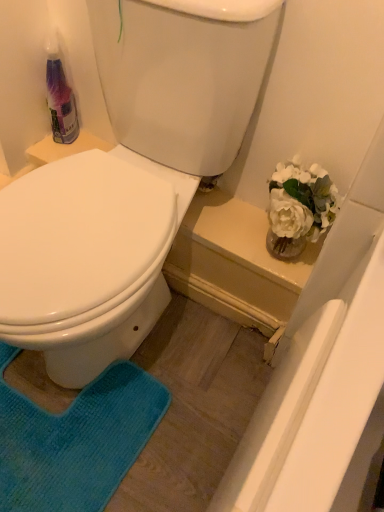
Question: Considering the relative sizes of white glossy toilet at center and translucent plastic bottle at upper left in the image provided, is white glossy toilet at center shorter than translucent plastic bottle at upper left?

Choices:
 (A) no
 (B) yes

Answer: (A)

Question: Is white glossy toilet at center looking in the opposite direction of translucent plastic bottle at upper left?

Choices:
 (A) yes
 (B) no

Answer: (B)

Question: Is white glossy toilet at center aimed at translucent plastic bottle at upper left?

Choices:
 (A) yes
 (B) no

Answer: (B)

Question: Is white glossy toilet at center completely or partially outside of translucent plastic bottle at upper left?

Choices:
 (A) yes
 (B) no

Answer: (A)

Question: From a real-world perspective, is white glossy toilet at center beneath translucent plastic bottle at upper left?

Choices:
 (A) no
 (B) yes

Answer: (B)

Question: Does point (233, 146) appear closer or farther from the camera than point (74, 472)?

Choices:
 (A) farther
 (B) closer

Answer: (A)

Question: From a real-world perspective, relative to blue textured rug at lower left, is white glossy toilet at center vertically above or below?

Choices:
 (A) above
 (B) below

Answer: (A)

Question: Looking at their shapes, would you say white glossy toilet at center is wider or thinner than blue textured rug at lower left?

Choices:
 (A) wide
 (B) thin

Answer: (A)

Question: From the image's perspective, is white glossy toilet at center above or below blue textured rug at lower left?

Choices:
 (A) above
 (B) below

Answer: (A)

Question: From a real-world perspective, is blue textured rug at lower left physically located above or below white glossy toilet at center?

Choices:
 (A) above
 (B) below

Answer: (B)

Question: Based on their positions, is blue textured rug at lower left located to the left or right of white glossy toilet at center?

Choices:
 (A) right
 (B) left

Answer: (B)

Question: Considering their positions, is blue textured rug at lower left located in front of or behind white glossy toilet at center?

Choices:
 (A) behind
 (B) front

Answer: (A)

Question: Based on their sizes in the image, would you say blue textured rug at lower left is bigger or smaller than white glossy toilet at center?

Choices:
 (A) big
 (B) small

Answer: (B)

Question: From a real-world perspective, is white glossy toilet at center above or below translucent plastic bottle at upper left?

Choices:
 (A) above
 (B) below

Answer: (B)

Question: Considering the positions of white glossy toilet at center and translucent plastic bottle at upper left in the image, is white glossy toilet at center taller or shorter than translucent plastic bottle at upper left?

Choices:
 (A) short
 (B) tall

Answer: (B)